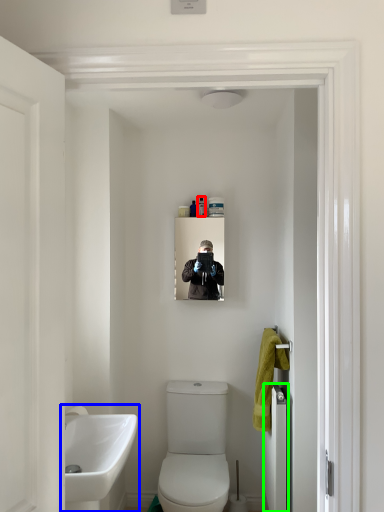
Question: Which is nearer to the toiletry (highlighted by a red box)? sink (highlighted by a blue box) or door (highlighted by a green box).

Choices:
 (A) sink
 (B) door

Answer: (B)